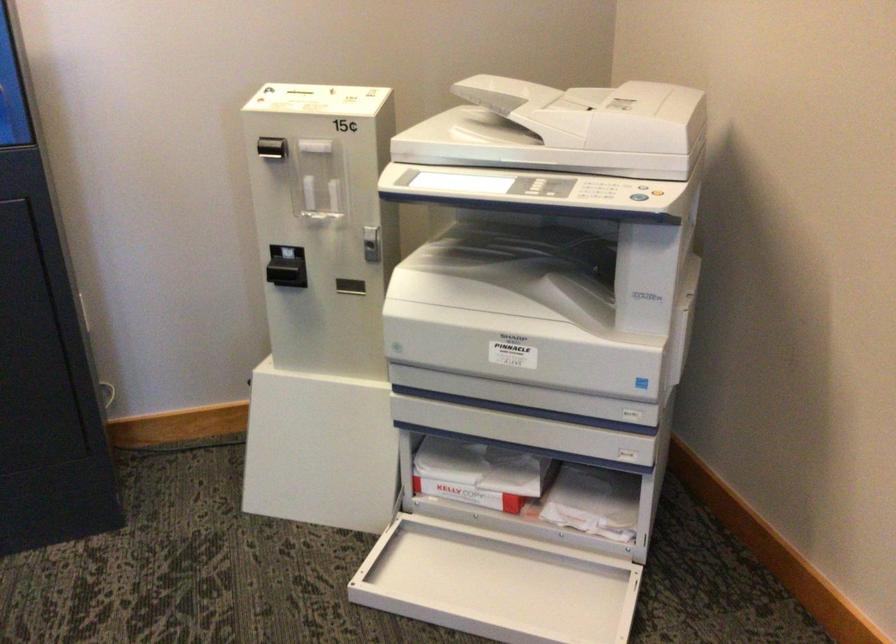
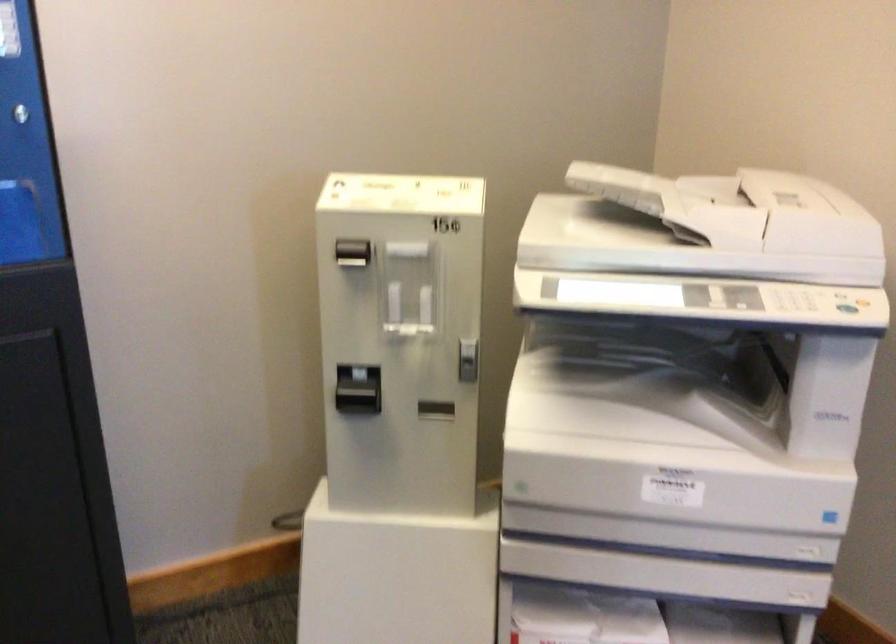
Question: The first image is from the beginning of the video and the second image is from the end. How did the camera likely rotate when shooting the video?

Choices:
 (A) Left
 (B) Right
 (C) Up
 (D) Down

Answer: (B)